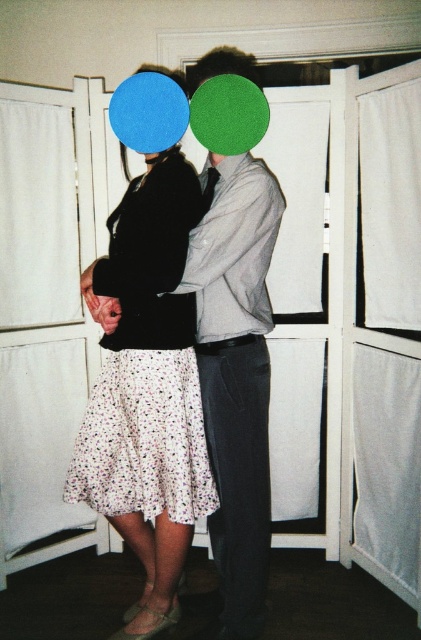
You are a photographer trying to capture a candid shot of the two people in the image. You want to ensure that the floral cotton dress at center and the matte green hair at center are both visible in the frame. Based on their positions, which object should you focus on first to include both in the shot?

The floral cotton dress at center is to the left of matte green hair at center, so focusing on the floral cotton dress at center first would allow you to frame both objects since it is positioned to the left side of the matte green hair at center.

You are designing a layout for a magazine spread and need to place two elements based on their sizes. The white floral skirt at lower left and the matte green hair at center must be arranged so that the wider object is placed on the left side of the spread. Which object should be placed on the left?

The white floral skirt at lower left should be placed on the left side of the spread since its width surpasses that of the matte green hair at center.

You are a photographer standing in front of the scene. You want to take a closeup of the floral cotton dress at center. The camera you are using has a minimum focusing distance of 5 feet. Can you take the photo without moving closer?

The floral cotton dress at center is 5.62 feet from viewer. Since the minimum focusing distance is 5 feet, the camera can focus on the floral cotton dress at center as it is within range.